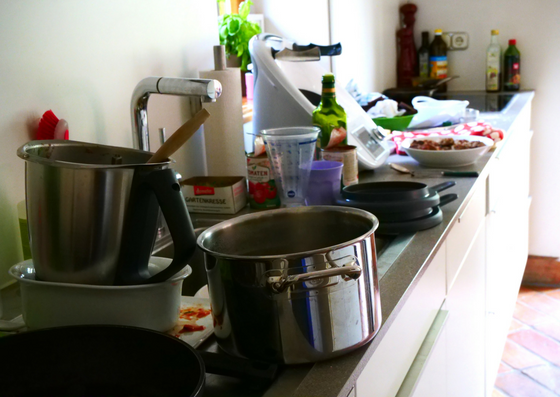
Where is `wall`? The height and width of the screenshot is (397, 560). wall is located at coordinates (153, 16), (516, 17).